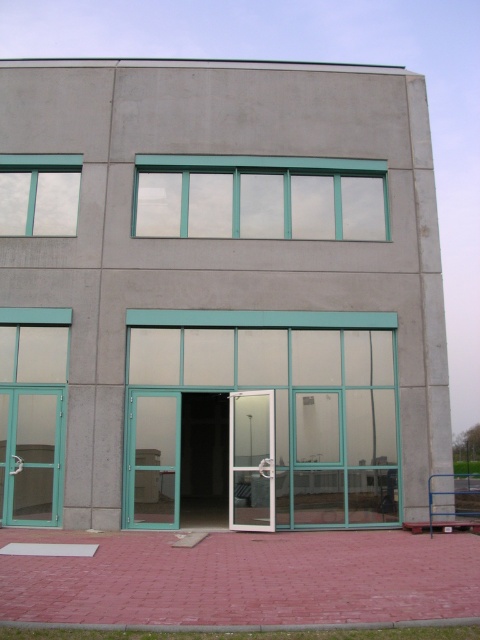
Is the position of clear glass window at upper center more distant than that of transparent glass door at center?

Yes, clear glass window at upper center is behind transparent glass door at center.

Who is positioned more to the right, clear glass window at upper center or transparent glass door at center?

clear glass window at upper center

What do you see at coordinates (261, 196) in the screenshot?
I see `clear glass window at upper center` at bounding box center [261, 196].

At what (x,y) coordinates should I click in order to perform the action: click on clear glass window at upper center. Please return your answer as a coordinate pair (x, y). Image resolution: width=480 pixels, height=640 pixels. Looking at the image, I should click on coord(261,196).

From the picture: Is matte glass window at upper left further to camera compared to transparent glass door at center?

Yes, it is.

Can you confirm if matte glass window at upper left is positioned to the left of transparent glass door at center?

Yes, matte glass window at upper left is to the left of transparent glass door at center.

Between point (14, 170) and point (249, 486), which one is positioned in front?

Point (249, 486) is more forward.

This screenshot has width=480, height=640. Find the location of `matte glass window at upper left`. matte glass window at upper left is located at coordinates (38, 193).

What do you see at coordinates (261, 196) in the screenshot? I see `clear glass window at upper center` at bounding box center [261, 196].

Does clear glass window at upper center have a greater height compared to matte glass window at upper left?

Correct, clear glass window at upper center is much taller as matte glass window at upper left.

The width and height of the screenshot is (480, 640). Identify the location of clear glass window at upper center. (261, 196).

Locate an element on the screen. The width and height of the screenshot is (480, 640). clear glass window at upper center is located at coordinates (261, 196).